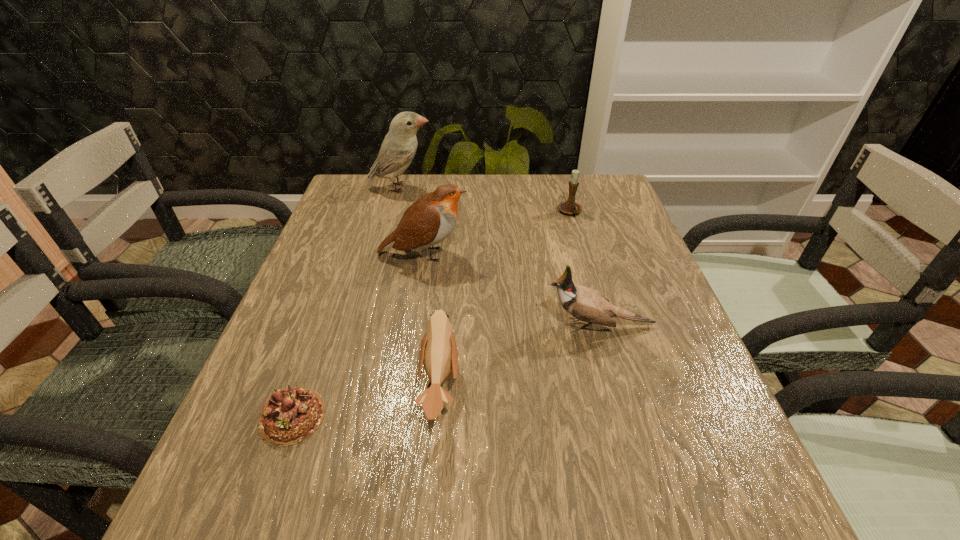
You are a GUI agent. You are given a task and a screenshot of the screen. Output one action in this format:
    pyautogui.click(x=<x>, y=<y>)
    Task: Click on the vacant space located 0.070m at the face of the fourth shortest object
    The width and height of the screenshot is (960, 540).
    Given the screenshot: What is the action you would take?
    pyautogui.click(x=507, y=326)

At what (x,y) coordinates should I click in order to perform the action: click on vacant space located 0.220m at the face of the fourth shortest object. Please return your answer as a coordinate pair (x, y). This screenshot has height=540, width=960. Looking at the image, I should click on (433, 326).

At what (x,y) coordinates should I click in order to perform the action: click on blank space located at the face of the fourth shortest object. Please return your answer as a coordinate pair (x, y). Image resolution: width=960 pixels, height=540 pixels. Looking at the image, I should click on (492, 326).

Where is `vacant space situated 0.270m on the side of the candle holder with the handle`? vacant space situated 0.270m on the side of the candle holder with the handle is located at coordinates (592, 289).

The image size is (960, 540). I want to click on blank area located at the beak of the shortest bird, so click(612, 388).

Identify the location of free space located 0.200m on the back of the shortest object. (330, 308).

Locate an element on the screen. bird that is at the far edge is located at coordinates (398, 149).

The height and width of the screenshot is (540, 960). Find the location of `candle holder located in the far edge section of the desktop`. candle holder located in the far edge section of the desktop is located at coordinates (570, 207).

Where is `chocolate cake that is at the left edge`? chocolate cake that is at the left edge is located at coordinates (291, 415).

You are a GUI agent. You are given a task and a screenshot of the screen. Output one action in this format:
    pyautogui.click(x=<x>, y=<y>)
    Task: Click on the bird located in the right edge section of the desktop
    The image size is (960, 540).
    Given the screenshot: What is the action you would take?
    coord(585,304)